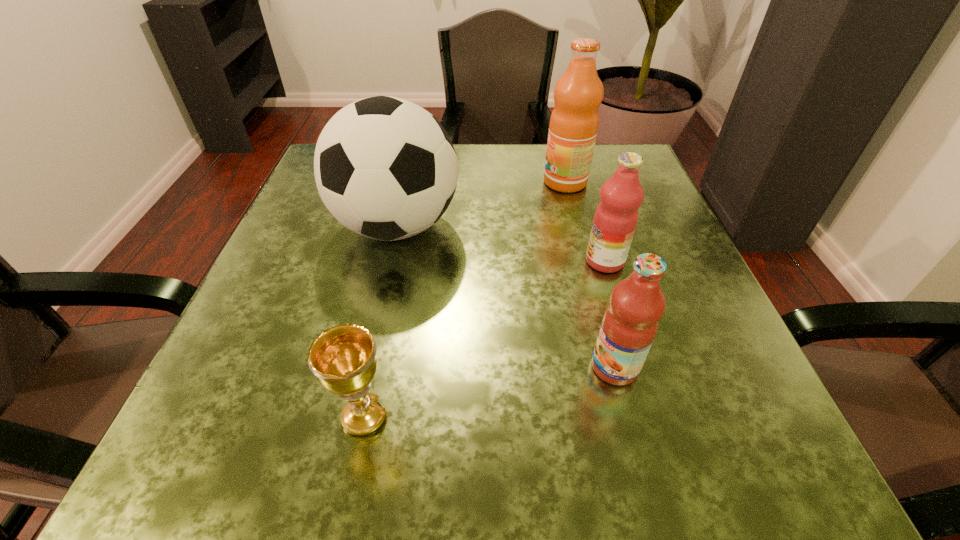
The width and height of the screenshot is (960, 540). I want to click on object at the left edge, so point(385,168).

The image size is (960, 540). Identify the location of object situated at the far left corner. (385, 168).

At what (x,y) coordinates should I click in order to perform the action: click on object that is at the far right corner. Please return your answer as a coordinate pair (x, y). This screenshot has width=960, height=540. Looking at the image, I should click on (574, 121).

The image size is (960, 540). In order to click on vacant space at the far edge of the desktop in this screenshot , I will do `click(479, 148)`.

Where is `free region at the near edge of the desktop`? free region at the near edge of the desktop is located at coordinates (405, 429).

You are a GUI agent. You are given a task and a screenshot of the screen. Output one action in this format:
    pyautogui.click(x=<x>, y=<y>)
    Task: Click on the blank space at the right edge of the desktop
    Image resolution: width=960 pixels, height=540 pixels.
    Given the screenshot: What is the action you would take?
    pyautogui.click(x=656, y=243)

This screenshot has width=960, height=540. In the image, there is a desktop. Find the location of `free space at the near left corner`. free space at the near left corner is located at coordinates (273, 474).

At what (x,y) coordinates should I click in order to perform the action: click on vacant point located between the nearest object and the second farthest fruit juice. Please return your answer as a coordinate pair (x, y). Looking at the image, I should click on (485, 339).

You are a GUI agent. You are given a task and a screenshot of the screen. Output one action in this format:
    pyautogui.click(x=<x>, y=<y>)
    Task: Click on the free spot between the farthest fruit juice and the second nearest fruit juice
    
    Given the screenshot: What is the action you would take?
    pyautogui.click(x=585, y=221)

At what (x,y) coordinates should I click in order to perform the action: click on free space between the tallest fruit juice and the second farthest fruit juice. Please return your answer as a coordinate pair (x, y). Looking at the image, I should click on (585, 221).